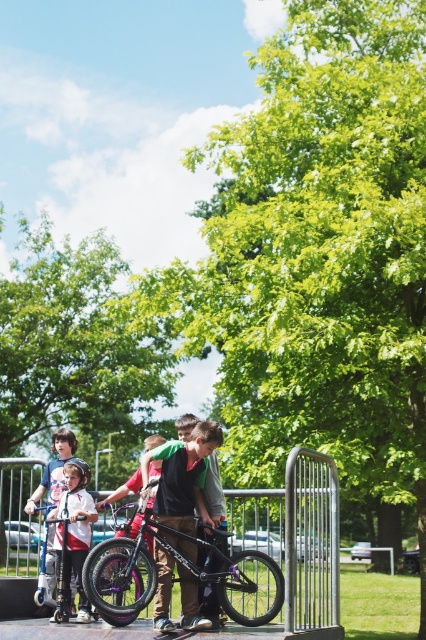
Does shiny purple bicycle at center appear over matte black shirt at center?

Actually, shiny purple bicycle at center is below matte black shirt at center.

Does shiny purple bicycle at center have a lesser height compared to matte black shirt at center?

No.

Is point (109, 616) in front of point (199, 460)?

Yes, point (109, 616) is in front of point (199, 460).

Identify the location of shiny purple bicycle at center. (232, 576).

Who is more distant from viewer, (94, 584) or (63, 561)?

The point (63, 561) is behind.

Does shiny purple bicycle at center have a lesser height compared to white matte scooter at lower left?

Result: No.

Who is more distant from viewer, (218, 573) or (81, 483)?

The point (81, 483) is more distant.

This screenshot has height=640, width=426. In order to click on shiny purple bicycle at center in this screenshot , I will do `click(232, 576)`.

Is matte black shirt at center to the left of white matte scooter at lower left from the viewer's perspective?

Incorrect, matte black shirt at center is not on the left side of white matte scooter at lower left.

Which of these two, matte black shirt at center or white matte scooter at lower left, stands taller?

matte black shirt at center

What do you see at coordinates (184, 474) in the screenshot? I see `matte black shirt at center` at bounding box center [184, 474].

The height and width of the screenshot is (640, 426). Identify the location of matte black shirt at center. (184, 474).